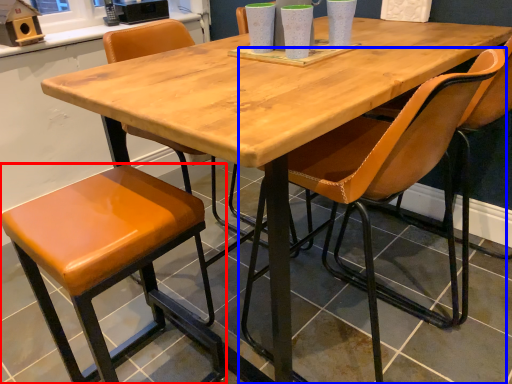
Question: Among these objects, which one is farthest to the camera, stool (highlighted by a red box) or chair (highlighted by a blue box)?

Choices:
 (A) stool
 (B) chair

Answer: (A)